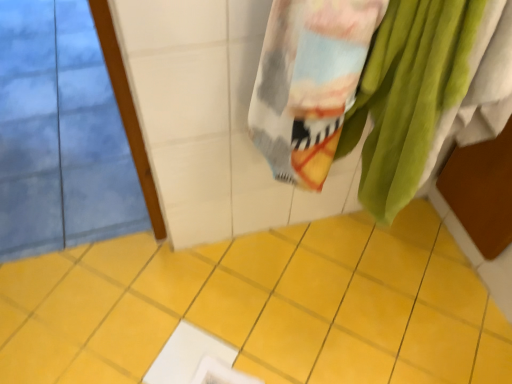
Describe the element at coordinates (428, 92) in the screenshot. This screenshot has height=384, width=512. I see `soft cotton towel at upper right` at that location.

I want to click on soft cotton towel at upper right, so click(428, 92).

At what (x,y) coordinates should I click in order to perform the action: click on yellow ceramic tile at center. Please return your answer as a coordinate pair (x, y). The width and height of the screenshot is (512, 384). Looking at the image, I should click on (261, 306).

This screenshot has height=384, width=512. What do you see at coordinates (261, 306) in the screenshot?
I see `yellow ceramic tile at center` at bounding box center [261, 306].

Measure the distance between point (508, 379) and camera.

Point (508, 379) and camera are 1.17 meters apart from each other.

At what (x,y) coordinates should I click in order to perform the action: click on soft cotton towel at upper right. Please return your answer as a coordinate pair (x, y). The height and width of the screenshot is (384, 512). Looking at the image, I should click on (428, 92).

Does soft cotton towel at upper right appear on the right side of yellow ceramic tile at center?

Correct, you'll find soft cotton towel at upper right to the right of yellow ceramic tile at center.

In the image, is soft cotton towel at upper right positioned in front of or behind yellow ceramic tile at center?

In the image, soft cotton towel at upper right appears in front of yellow ceramic tile at center.

Is point (412, 109) less distant than point (459, 319)?

That is True.

From the image's perspective, which one is positioned higher, soft cotton towel at upper right or yellow ceramic tile at center?

soft cotton towel at upper right.

From a real-world perspective, is soft cotton towel at upper right on yellow ceramic tile at center?

Yes, from a real-world perspective, soft cotton towel at upper right is above yellow ceramic tile at center.

Which of these two, soft cotton towel at upper right or yellow ceramic tile at center, is wider?

yellow ceramic tile at center is wider.

Considering the relative sizes of soft cotton towel at upper right and yellow ceramic tile at center in the image provided, is soft cotton towel at upper right shorter than yellow ceramic tile at center?

No.

Who is bigger, soft cotton towel at upper right or yellow ceramic tile at center?

soft cotton towel at upper right is bigger.

Is soft cotton towel at upper right positioned beyond the bounds of yellow ceramic tile at center?

Indeed, soft cotton towel at upper right is completely outside yellow ceramic tile at center.

Based on the photo, are soft cotton towel at upper right and yellow ceramic tile at center far apart?

That's not correct — soft cotton towel at upper right is a little close to yellow ceramic tile at center.

Is soft cotton towel at upper right aimed at yellow ceramic tile at center?

No, soft cotton towel at upper right is not turned towards yellow ceramic tile at center.

How many degrees apart are the facing directions of soft cotton towel at upper right and yellow ceramic tile at center?

The angle between the facing direction of soft cotton towel at upper right and the facing direction of yellow ceramic tile at center is 178 degrees.

Where is `ceramic tile below the soft cotton towel at upper right (from a real-world perspective)`? ceramic tile below the soft cotton towel at upper right (from a real-world perspective) is located at coordinates tap(261, 306).

Can you confirm if yellow ceramic tile at center is positioned to the right of soft cotton towel at upper right?

Incorrect, yellow ceramic tile at center is not on the right side of soft cotton towel at upper right.

Is yellow ceramic tile at center in front of or behind soft cotton towel at upper right in the image?

In the image, yellow ceramic tile at center appears behind soft cotton towel at upper right.

Which is behind, point (402, 321) or point (499, 78)?

The point (402, 321) is farther from the camera.

From the image's perspective, is yellow ceramic tile at center under soft cotton towel at upper right?

Correct, yellow ceramic tile at center appears lower than soft cotton towel at upper right in the image.

From a real-world perspective, is yellow ceramic tile at center below soft cotton towel at upper right?

Yes, from a real-world perspective, yellow ceramic tile at center is under soft cotton towel at upper right.

Which object is thinner, yellow ceramic tile at center or soft cotton towel at upper right?

soft cotton towel at upper right is thinner.

In terms of height, does yellow ceramic tile at center look taller or shorter compared to soft cotton towel at upper right?

yellow ceramic tile at center is shorter than soft cotton towel at upper right.

Considering the sizes of yellow ceramic tile at center and soft cotton towel at upper right in the image, is yellow ceramic tile at center bigger or smaller than soft cotton towel at upper right?

yellow ceramic tile at center is smaller than soft cotton towel at upper right.

Would you say yellow ceramic tile at center is outside soft cotton towel at upper right?

yellow ceramic tile at center lies outside soft cotton towel at upper right's area.

Is yellow ceramic tile at center positioned far away from soft cotton towel at upper right?

yellow ceramic tile at center is actually quite close to soft cotton towel at upper right.

Is soft cotton towel at upper right at the back of yellow ceramic tile at center?

No, yellow ceramic tile at center is not facing away from soft cotton towel at upper right.

How different are the orientations of yellow ceramic tile at center and soft cotton towel at upper right in degrees?

They differ by 178 degrees in their facing directions.

Image resolution: width=512 pixels, height=384 pixels. Identify the location of ceramic tile that appears below the soft cotton towel at upper right (from the image's perspective). (261, 306).

There is a yellow ceramic tile at center. Where is `towel above it (from a real-world perspective)`? towel above it (from a real-world perspective) is located at coordinates (428, 92).

The height and width of the screenshot is (384, 512). Find the location of `towel in front of the yellow ceramic tile at center`. towel in front of the yellow ceramic tile at center is located at coordinates tap(428, 92).